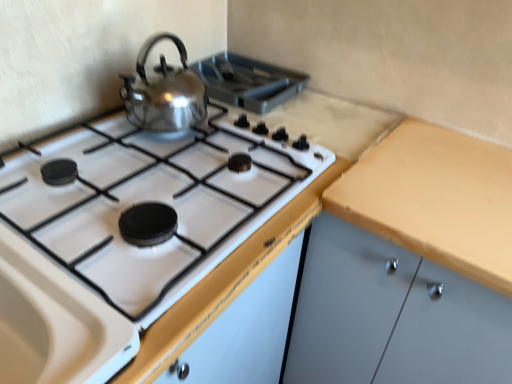
Question: Considering the positions of polished stainless steel kettle at upper center and shiny metallic kettle at upper left in the image, is polished stainless steel kettle at upper center wider or thinner than shiny metallic kettle at upper left?

Choices:
 (A) thin
 (B) wide

Answer: (B)

Question: Considering the relative positions of polished stainless steel kettle at upper center and shiny metallic kettle at upper left in the image provided, is polished stainless steel kettle at upper center to the left or to the right of shiny metallic kettle at upper left?

Choices:
 (A) left
 (B) right

Answer: (B)

Question: Which object is the farthest from the polished stainless steel kettle at upper center?

Choices:
 (A) shiny metallic kettle at upper left
 (B) matte wood cabinet at right

Answer: (B)

Question: Which object is positioned farthest from the polished stainless steel kettle at upper center?

Choices:
 (A) matte wood cabinet at right
 (B) shiny metallic kettle at upper left

Answer: (A)